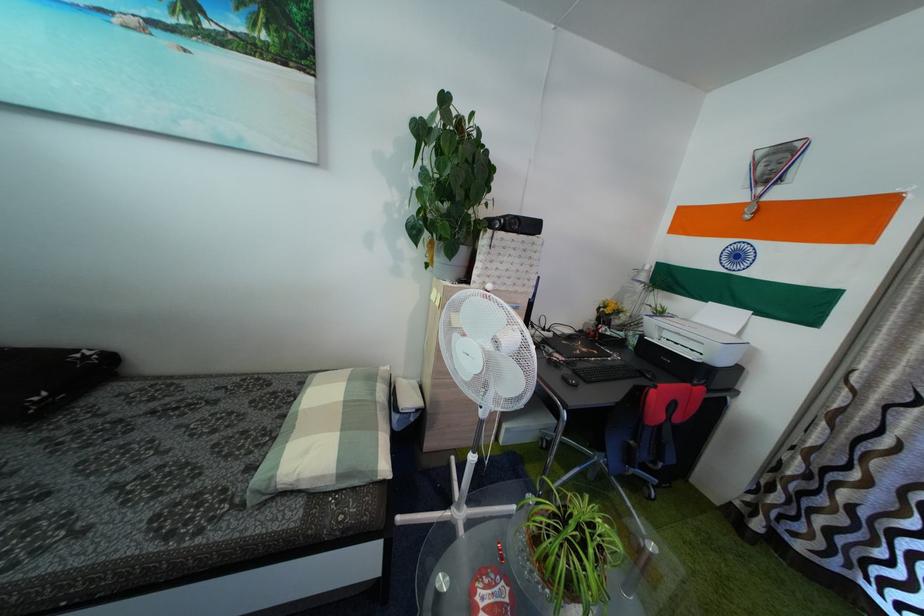
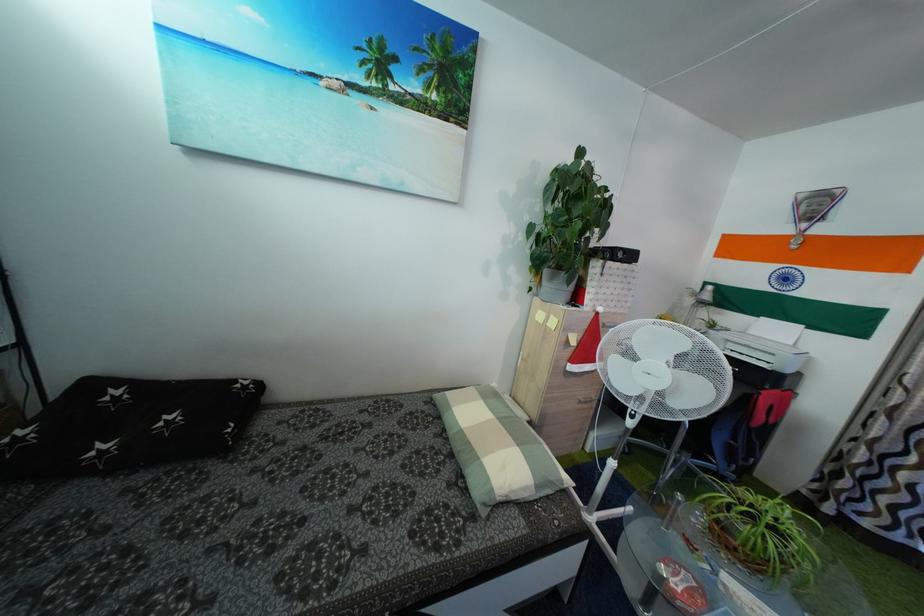
Question: The camera is either moving clockwise (left) or counter-clockwise (right) around the object. The first image is from the beginning of the video and the second image is from the end. Is the camera moving left or right when shooting the video?

Choices:
 (A) Left
 (B) Right

Answer: (A)